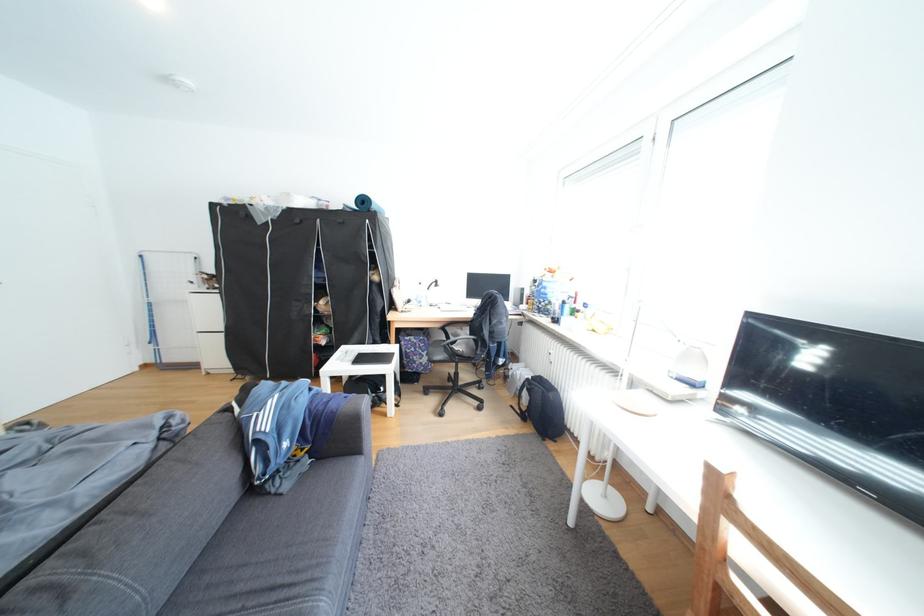
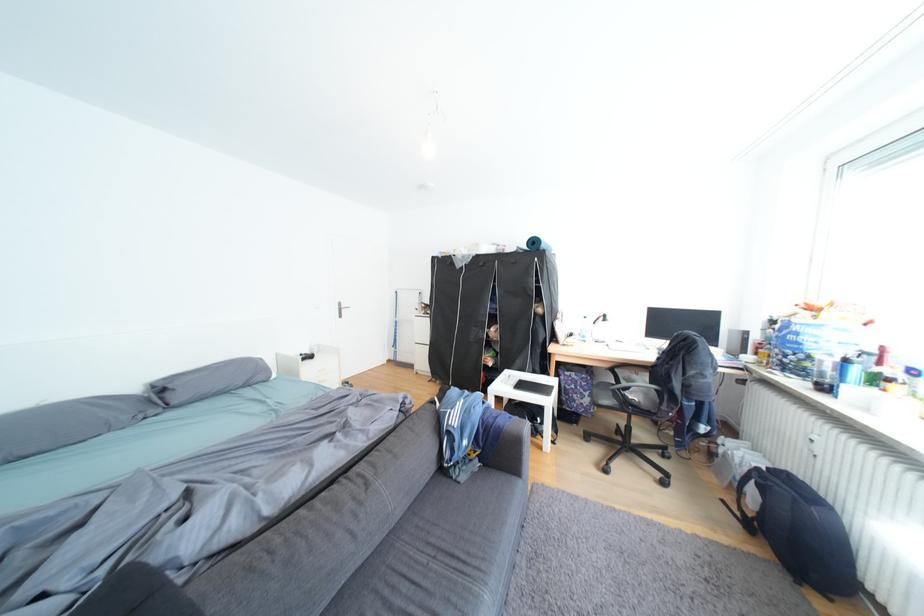
Find the pixel in the second image that matches pixel 577 304 in the first image.

(859, 362)